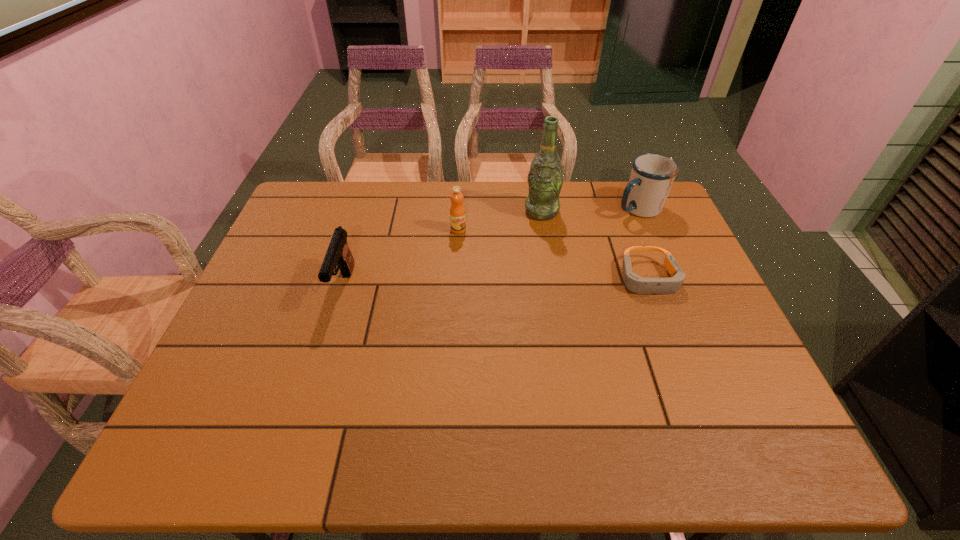
Where is `orange juice located at the far edge`? This screenshot has width=960, height=540. orange juice located at the far edge is located at coordinates (457, 211).

Where is `goggles at the right edge`? Image resolution: width=960 pixels, height=540 pixels. goggles at the right edge is located at coordinates (633, 282).

This screenshot has height=540, width=960. In order to click on mug situated at the right edge in this screenshot , I will do `click(652, 175)`.

The image size is (960, 540). Identify the location of object located in the far right corner section of the desktop. (652, 175).

The width and height of the screenshot is (960, 540). I want to click on vacant space at the far edge, so click(436, 206).

Where is `vacant space at the near edge of the desktop`? Image resolution: width=960 pixels, height=540 pixels. vacant space at the near edge of the desktop is located at coordinates 291,410.

Identify the location of free space at the left edge of the desktop. (291, 275).

The height and width of the screenshot is (540, 960). Identify the location of free space at the right edge of the desktop. (703, 291).

In the image, there is a desktop. Where is `free region at the far left corner`? free region at the far left corner is located at coordinates (289, 220).

Locate an element on the screen. Image resolution: width=960 pixels, height=540 pixels. vacant space at the near left corner of the desktop is located at coordinates (253, 375).